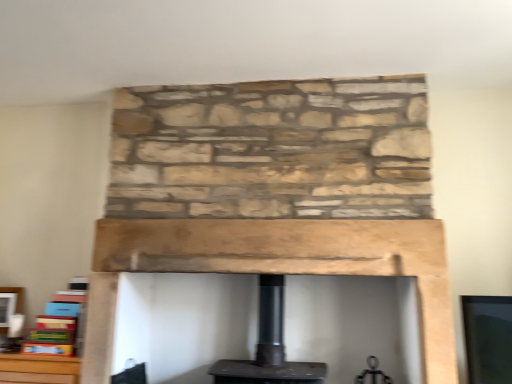
Where is `smooth wood mantle at center`? This screenshot has width=512, height=384. smooth wood mantle at center is located at coordinates (273, 193).

What do you see at coordinates (273, 193) in the screenshot? I see `smooth wood mantle at center` at bounding box center [273, 193].

Identify the location of smooth wood mantle at center. (273, 193).